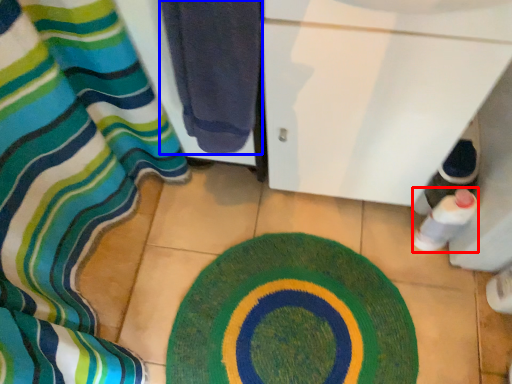
Question: Which of the following is the closest to the observer, bottle (highlighted by a red box) or towel (highlighted by a blue box)?

Choices:
 (A) bottle
 (B) towel

Answer: (B)